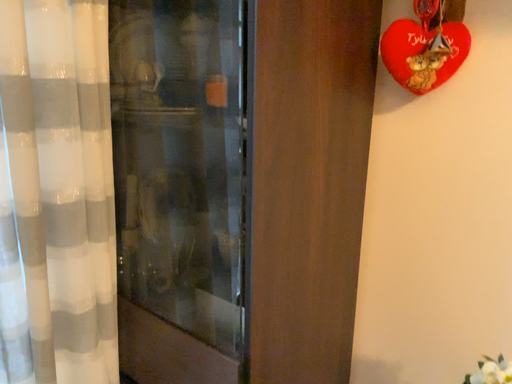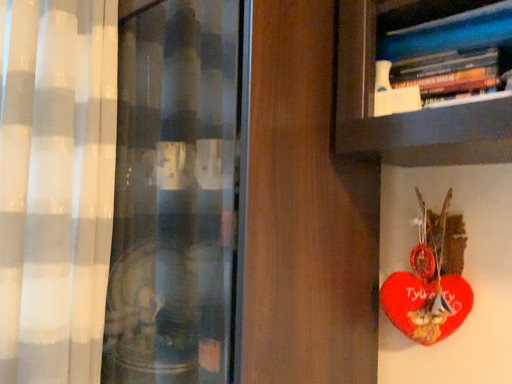
Question: Which way did the camera rotate in the video?

Choices:
 (A) rotated downward
 (B) rotated upward

Answer: (B)